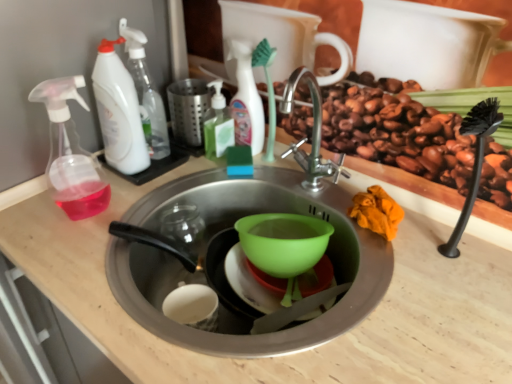
This screenshot has height=384, width=512. What are the coordinates of `vacant space that is to the left of white matte bottle at upper center, the first cleaning product from the right` in the screenshot? It's located at (177, 166).